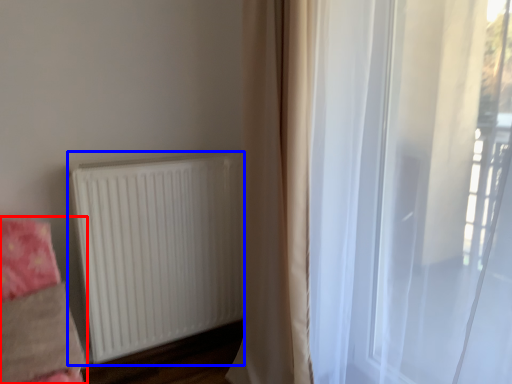
Question: Among these objects, which one is farthest to the camera, bedding (highlighted by a red box) or radiator (highlighted by a blue box)?

Choices:
 (A) bedding
 (B) radiator

Answer: (B)